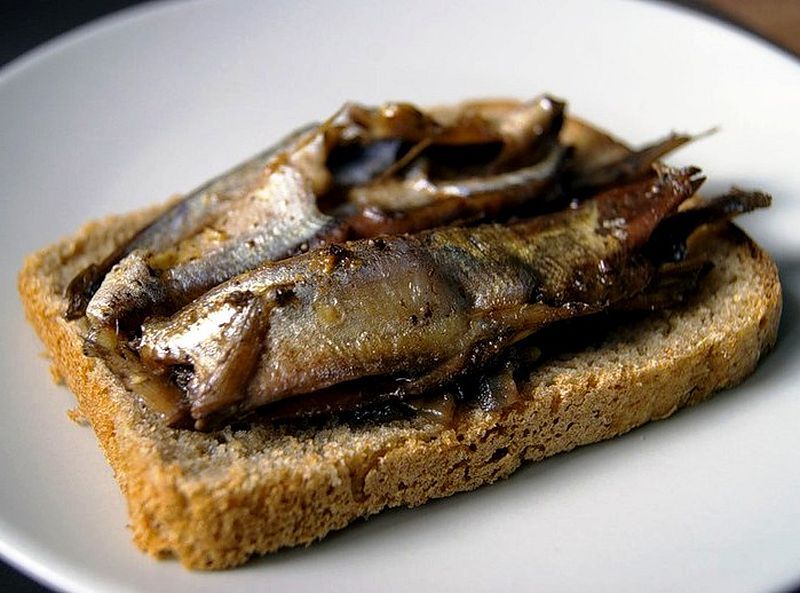
The height and width of the screenshot is (593, 800). What are the coordinates of `white plate` in the screenshot? It's located at (166, 123).